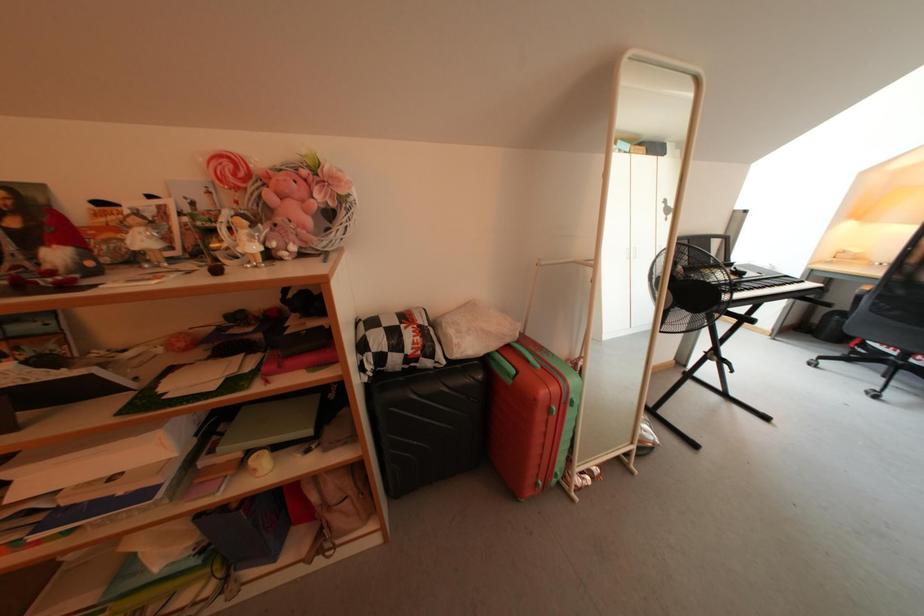
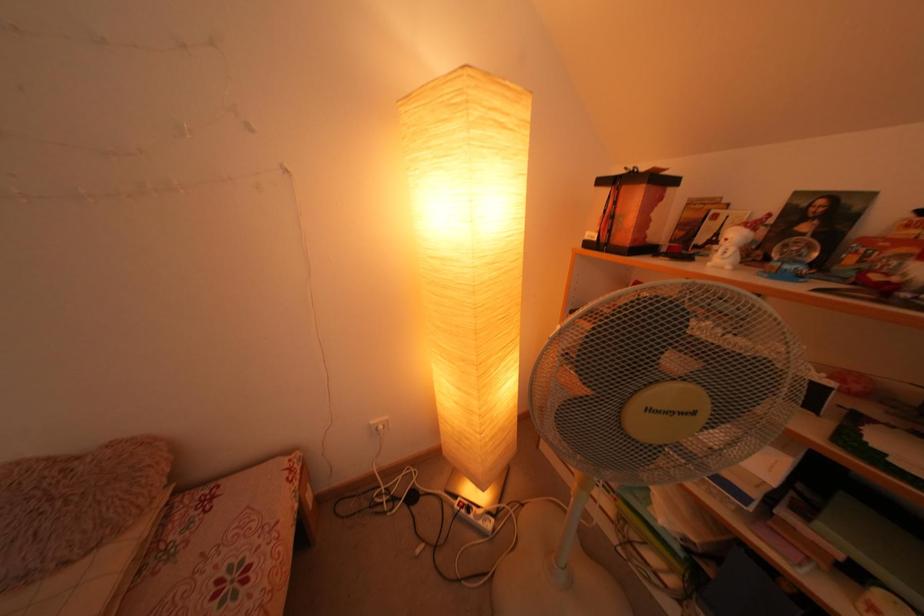
The images are taken continuously from a first-person perspective. In which direction is your viewpoint rotating?

The camera rotated toward left-down.